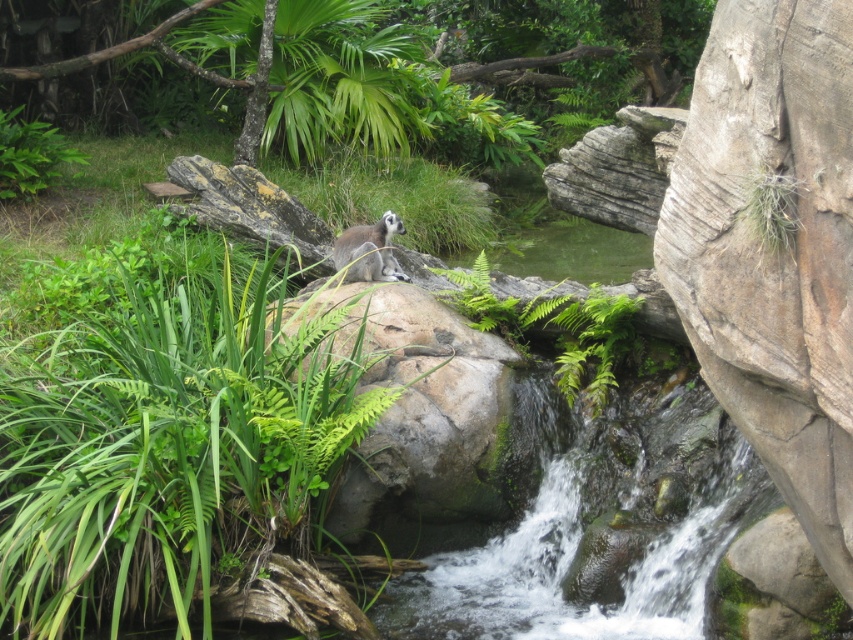
You are standing at the point labeled point (109, 627) and want to move towards the point labeled point (381, 228). Given that you can only move forward in a straight line, will you pass closer to the waterfall or the lemur first?

Since point (109, 627) is closer to the viewer than point (381, 228), moving straight towards the latter would mean you first pass closer to the waterfall before reaching the area near the lemur.